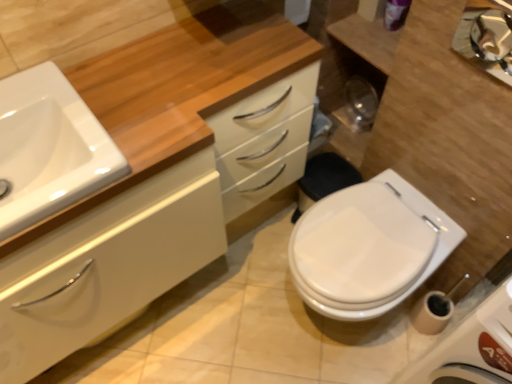
Question: Considering the relative sizes of metallic reflective mirror at upper right and white glossy cabinet at center in the image provided, is metallic reflective mirror at upper right smaller than white glossy cabinet at center?

Choices:
 (A) yes
 (B) no

Answer: (A)

Question: Considering the relative sizes of metallic reflective mirror at upper right and white glossy cabinet at center in the image provided, is metallic reflective mirror at upper right thinner than white glossy cabinet at center?

Choices:
 (A) no
 (B) yes

Answer: (B)

Question: Does metallic reflective mirror at upper right have a lesser height compared to white glossy cabinet at center?

Choices:
 (A) yes
 (B) no

Answer: (A)

Question: Is metallic reflective mirror at upper right to the right of white glossy cabinet at center from the viewer's perspective?

Choices:
 (A) no
 (B) yes

Answer: (B)

Question: Is metallic reflective mirror at upper right facing towards white glossy cabinet at center?

Choices:
 (A) no
 (B) yes

Answer: (A)

Question: Is point (505, 1) positioned closer to the camera than point (380, 193)?

Choices:
 (A) closer
 (B) farther

Answer: (A)

Question: Considering the relative positions of metallic reflective mirror at upper right and white glossy toilet at lower right in the image provided, is metallic reflective mirror at upper right to the left or to the right of white glossy toilet at lower right?

Choices:
 (A) left
 (B) right

Answer: (B)

Question: From a real-world perspective, is metallic reflective mirror at upper right above or below white glossy toilet at lower right?

Choices:
 (A) above
 (B) below

Answer: (A)

Question: Is metallic reflective mirror at upper right wider or thinner than white glossy toilet at lower right?

Choices:
 (A) thin
 (B) wide

Answer: (A)

Question: Based on their sizes in the image, would you say white glossy toilet at lower right is bigger or smaller than white glossy cabinet at center?

Choices:
 (A) big
 (B) small

Answer: (B)

Question: Is white glossy toilet at lower right wider or thinner than white glossy cabinet at center?

Choices:
 (A) thin
 (B) wide

Answer: (B)

Question: Considering the relative positions of white glossy toilet at lower right and white glossy cabinet at center in the image provided, is white glossy toilet at lower right to the left or to the right of white glossy cabinet at center?

Choices:
 (A) right
 (B) left

Answer: (A)

Question: From a real-world perspective, is white glossy toilet at lower right positioned above or below white glossy cabinet at center?

Choices:
 (A) above
 (B) below

Answer: (B)

Question: Based on their sizes in the image, would you say white glossy sink at left is bigger or smaller than metallic reflective mirror at upper right?

Choices:
 (A) small
 (B) big

Answer: (B)

Question: Relative to metallic reflective mirror at upper right, is white glossy sink at left in front or behind?

Choices:
 (A) front
 (B) behind

Answer: (A)